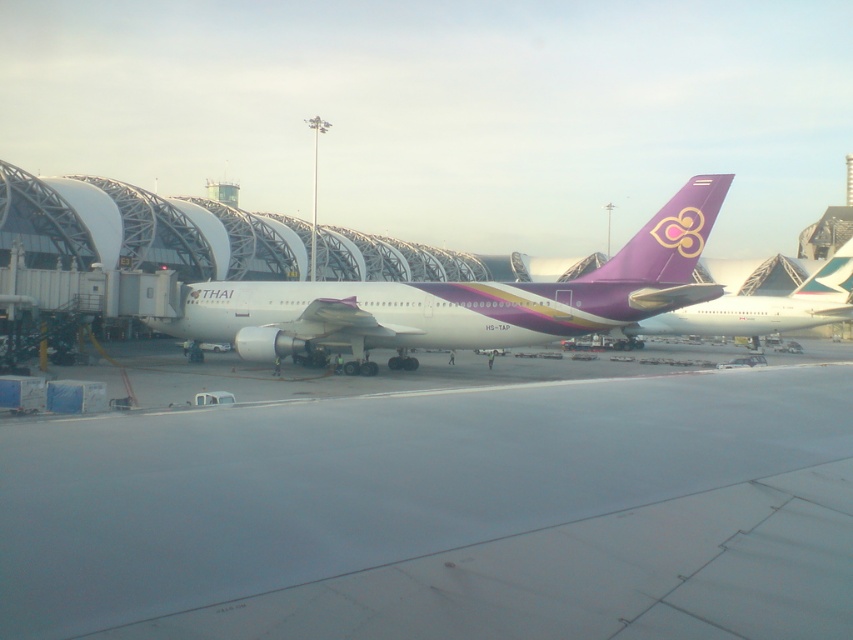
Question: Which point is farther to the camera?

Choices:
 (A) purple glossy airplane at upper right
 (B) smooth concrete runway at center

Answer: (A)

Question: Which point is farther to the camera?

Choices:
 (A) smooth concrete runway at center
 (B) white glossy airplane at center

Answer: (B)

Question: Can you confirm if smooth concrete runway at center is positioned below purple glossy airplane at upper right?

Choices:
 (A) no
 (B) yes

Answer: (B)

Question: In this image, where is smooth concrete runway at center located relative to purple glossy airplane at upper right?

Choices:
 (A) left
 (B) right

Answer: (A)

Question: Can you confirm if white glossy airplane at center is wider than purple glossy airplane at upper right?

Choices:
 (A) no
 (B) yes

Answer: (A)

Question: Which point is closer to the camera taking this photo?

Choices:
 (A) (13, 538)
 (B) (653, 321)

Answer: (A)